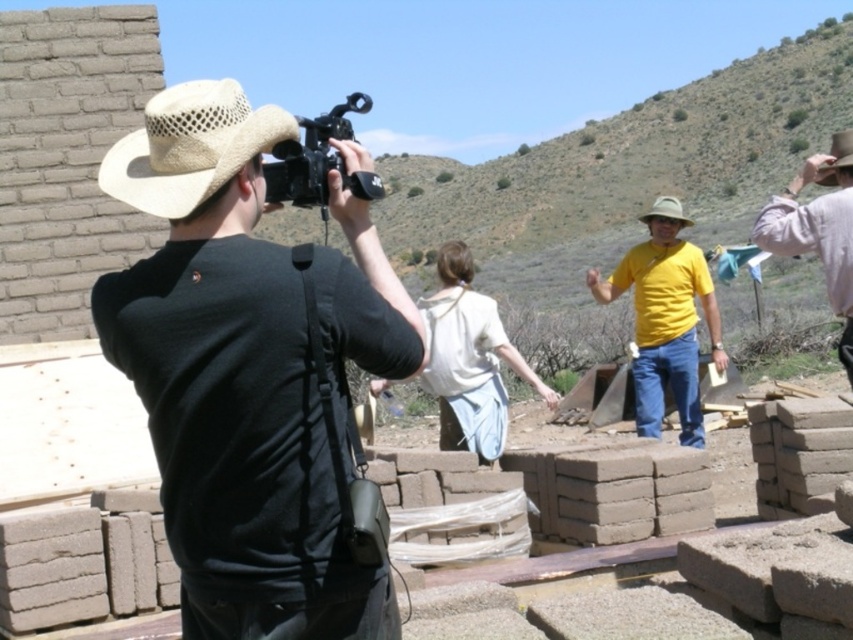
Who is positioned more to the left, matte straw hat at center or beige straw hat at upper left?

Positioned to the left is beige straw hat at upper left.

Measure the distance between point (157, 216) and camera.

Point (157, 216) is 15.95 feet away from camera.

Does point (136, 177) come behind point (212, 128)?

Yes, it is behind point (212, 128).

Identify the location of matte straw hat at center. (231, 381).

Is point (184, 218) closer to viewer compared to point (318, 196)?

Yes, it is.

Image resolution: width=853 pixels, height=640 pixels. What do you see at coordinates (190, 147) in the screenshot?
I see `beige straw hat at upper left` at bounding box center [190, 147].

Where is `beige straw hat at upper left`? The width and height of the screenshot is (853, 640). beige straw hat at upper left is located at coordinates (190, 147).

Who is taller, light brown leather hat at right or light brown straw cowboy hat at center?

With more height is light brown straw cowboy hat at center.

Can you confirm if light brown leather hat at right is wider than light brown straw cowboy hat at center?

No.

Between point (839, 266) and point (656, 202), which one is positioned in front?

Point (839, 266) is more forward.

Where is `light brown leather hat at right`? This screenshot has width=853, height=640. light brown leather hat at right is located at coordinates (817, 228).